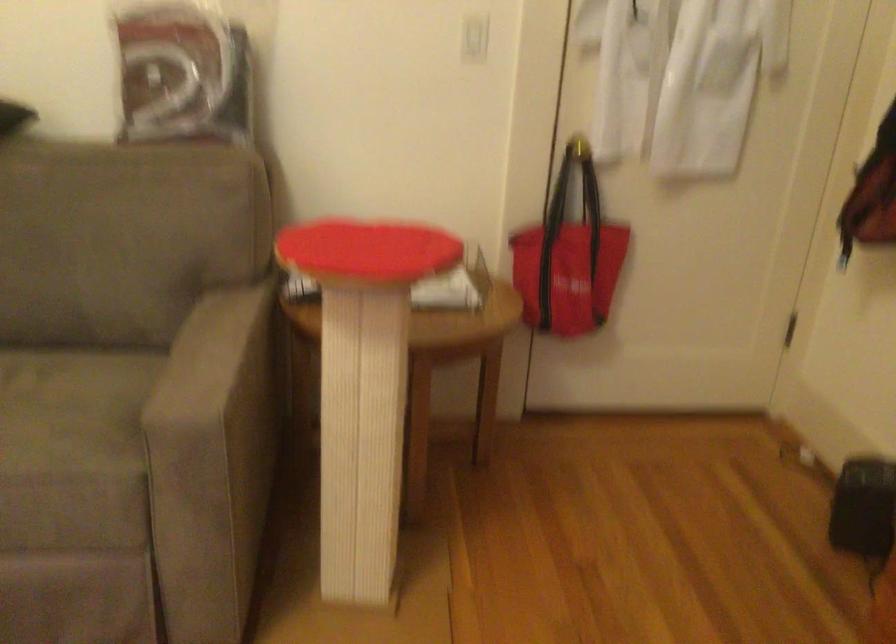
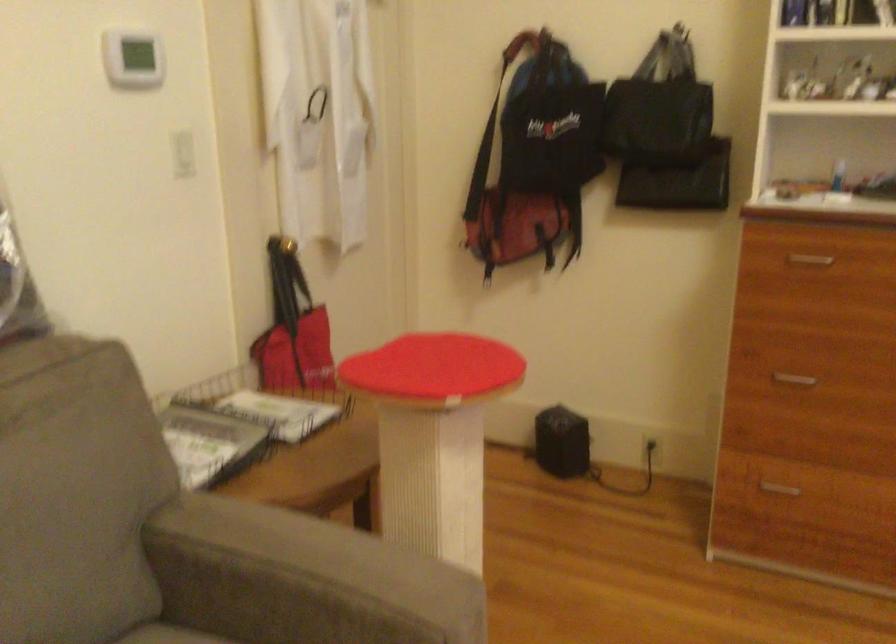
Where in the second image is the point corresponding to point (570, 180) from the first image?

(286, 281)